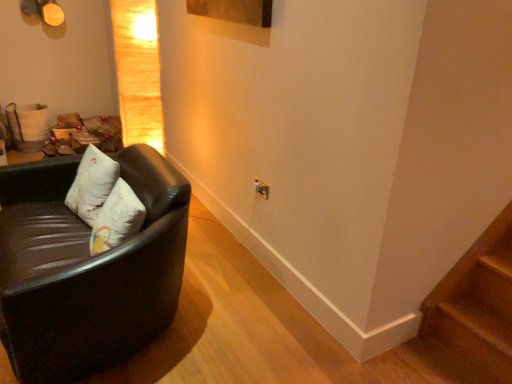
I want to click on empty space that is to the right of black leather couch at left, so click(x=245, y=309).